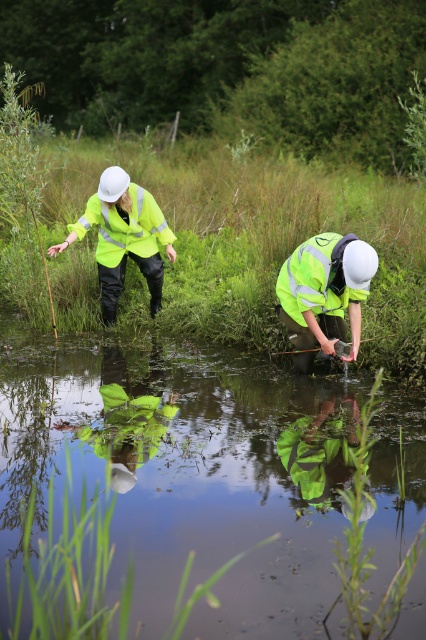
Which is more to the left, transparent plastic stream at center or high-visibility fabric safety vest at lower right?

Positioned to the left is transparent plastic stream at center.

Can you confirm if transparent plastic stream at center is bigger than high-visibility fabric safety vest at lower right?

Yes, transparent plastic stream at center is bigger than high-visibility fabric safety vest at lower right.

Does point (402, 602) come behind point (302, 282)?

No, it is in front of (302, 282).

The height and width of the screenshot is (640, 426). I want to click on transparent plastic stream at center, so click(184, 470).

Is point (101, 257) closer to viewer compared to point (336, 234)?

No, it is not.

Which of these two, high-visibility fabric safety vest at upper left or high-visibility fabric safety vest at lower right, stands taller?

Standing taller between the two is high-visibility fabric safety vest at upper left.

This screenshot has height=640, width=426. In order to click on high-visibility fabric safety vest at upper left in this screenshot , I will do `click(124, 227)`.

Can you confirm if transparent plastic stream at center is taller than high-visibility fabric safety vest at upper left?

Correct, transparent plastic stream at center is much taller as high-visibility fabric safety vest at upper left.

Which is below, transparent plastic stream at center or high-visibility fabric safety vest at upper left?

transparent plastic stream at center is below.

Between point (170, 474) and point (81, 216), which one is positioned behind?

The point (81, 216) is behind.

Locate an element on the screen. transparent plastic stream at center is located at coordinates (184, 470).